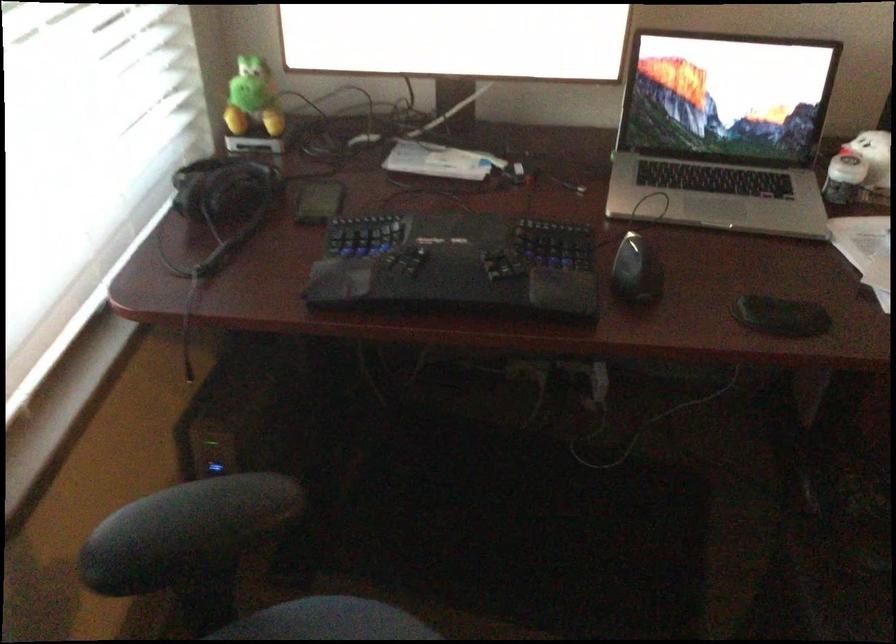
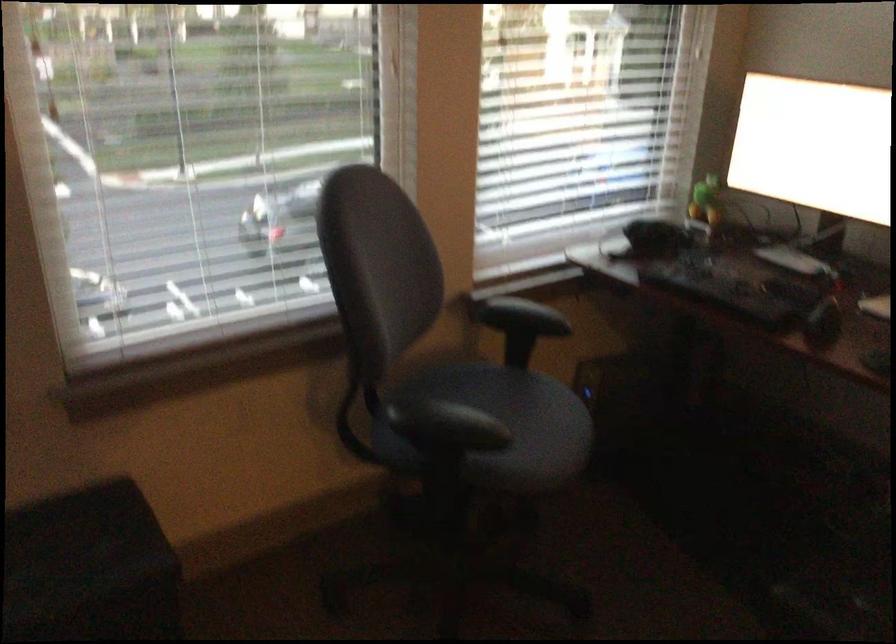
The point at (211, 522) is marked in the first image. Where is the corresponding point in the second image?

(523, 315)